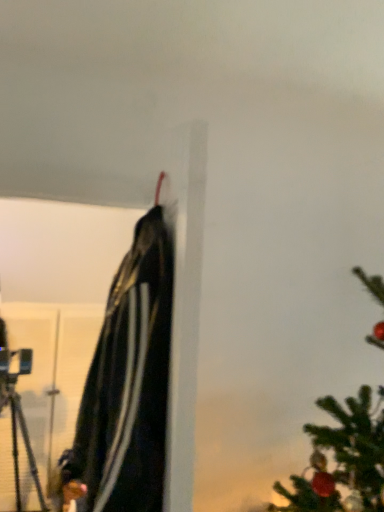
Question: Is black matte jacket at upper center beside black matte tripod at left?

Choices:
 (A) no
 (B) yes

Answer: (A)

Question: From the image's perspective, is black matte jacket at upper center below black matte tripod at left?

Choices:
 (A) no
 (B) yes

Answer: (A)

Question: Considering the relative sizes of black matte jacket at upper center and black matte tripod at left in the image provided, is black matte jacket at upper center smaller than black matte tripod at left?

Choices:
 (A) yes
 (B) no

Answer: (A)

Question: Is there a large distance between black matte jacket at upper center and black matte tripod at left?

Choices:
 (A) yes
 (B) no

Answer: (A)

Question: From a real-world perspective, is black matte jacket at upper center physically above black matte tripod at left?

Choices:
 (A) no
 (B) yes

Answer: (B)

Question: Considering the relative sizes of black matte jacket at upper center and black matte tripod at left in the image provided, is black matte jacket at upper center taller than black matte tripod at left?

Choices:
 (A) no
 (B) yes

Answer: (A)

Question: From a real-world perspective, is black matte tripod at left positioned under black matte jacket at upper center based on gravity?

Choices:
 (A) yes
 (B) no

Answer: (A)

Question: From the image's perspective, is black matte tripod at left located beneath black matte jacket at upper center?

Choices:
 (A) no
 (B) yes

Answer: (B)

Question: Is black matte tripod at left smaller than black matte jacket at upper center?

Choices:
 (A) yes
 (B) no

Answer: (B)

Question: Is black matte tripod at left completely or partially outside of black matte jacket at upper center?

Choices:
 (A) no
 (B) yes

Answer: (B)

Question: Is black matte tripod at left facing towards black matte jacket at upper center?

Choices:
 (A) yes
 (B) no

Answer: (A)

Question: Can you confirm if black matte tripod at left is positioned to the right of black matte jacket at upper center?

Choices:
 (A) no
 (B) yes

Answer: (A)

Question: Visually, is black matte tripod at left positioned to the left or to the right of black matte jacket at upper center?

Choices:
 (A) right
 (B) left

Answer: (B)